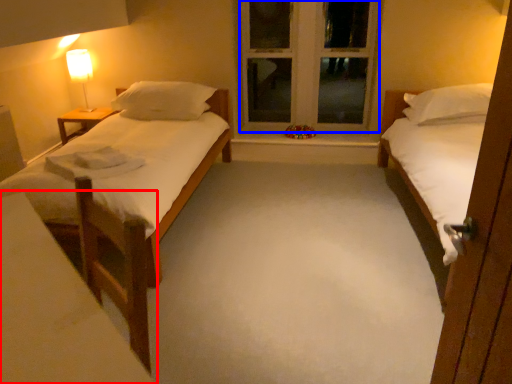
Question: Which object appears closest to the camera in this image, vanity (highlighted by a red box) or window frame (highlighted by a blue box)?

Choices:
 (A) vanity
 (B) window frame

Answer: (A)